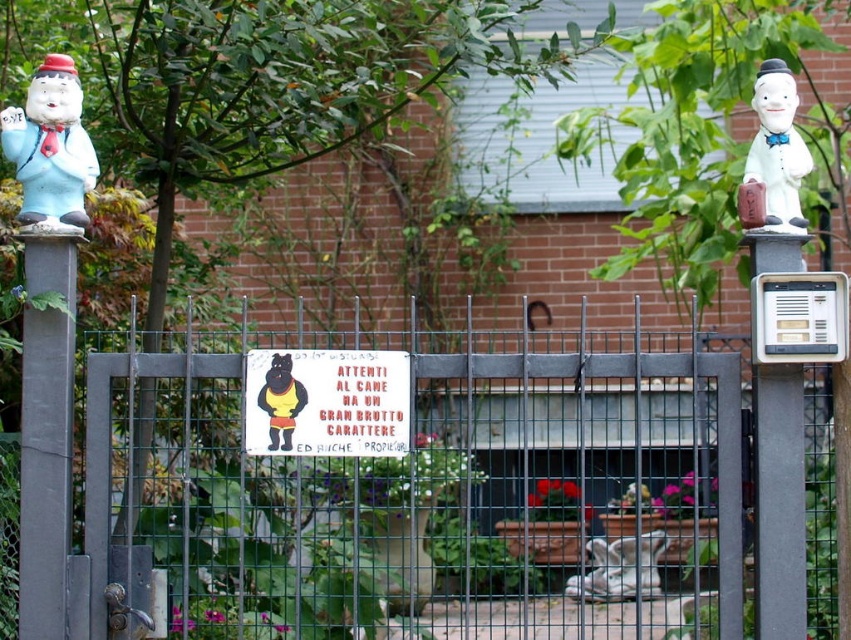
Question: Which of these objects is positioned closest to the white plastic mailbox at right?

Choices:
 (A) metallic wire mesh gate at center
 (B) white porcelain figurine at upper right
 (C) yellow paper sign at center
 (D) white plastic intercom at right

Answer: (D)

Question: From the image, what is the correct spatial relationship of white plastic mailbox at right in relation to white porcelain figurine at upper right?

Choices:
 (A) above
 (B) below

Answer: (B)

Question: Based on their relative distances, which object is farther from the yellow paper sign at center?

Choices:
 (A) metallic wire mesh gate at center
 (B) white plastic mailbox at right

Answer: (A)

Question: Which of the following is the farthest from the observer?

Choices:
 (A) (831, 292)
 (B) (36, 365)
 (C) (792, 588)

Answer: (B)

Question: Does white plastic intercom at right appear under white porcelain figurine at upper right?

Choices:
 (A) no
 (B) yes

Answer: (B)

Question: Does yellow paper sign at center appear on the right side of white porcelain figurine at upper right?

Choices:
 (A) yes
 (B) no

Answer: (B)